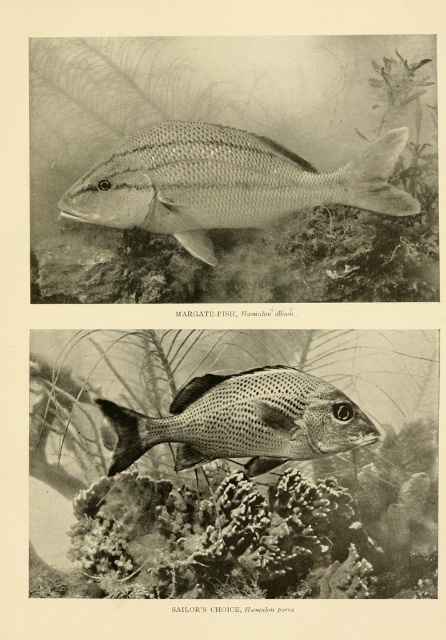
Between smooth silver fish at center and speckled silver fish at center, which one has more height?

Standing taller between the two is smooth silver fish at center.

This screenshot has height=640, width=446. I want to click on smooth silver fish at center, so click(x=224, y=182).

I want to click on smooth silver fish at center, so click(x=224, y=182).

Can you confirm if speckled coral at center is bigger than speckled silver fish at center?

Indeed, speckled coral at center has a larger size compared to speckled silver fish at center.

Is speckled coral at center below speckled silver fish at center?

Indeed, speckled coral at center is positioned under speckled silver fish at center.

At what (x,y) coordinates should I click in order to perform the action: click on speckled coral at center. Please return your answer as a coordinate pair (x, y). The image size is (446, 640). Looking at the image, I should click on (259, 531).

Locate an element on the screen. speckled coral at center is located at coordinates (259, 531).

Which is behind, point (79, 524) or point (128, 164)?

Positioned behind is point (79, 524).

Does speckled coral at center lie behind smooth silver fish at center?

No, speckled coral at center is closer to the viewer.

Who is more distant from viewer, [424,451] or [404,192]?

The point [424,451] is more distant.

This screenshot has height=640, width=446. Find the location of `speckled coral at center`. speckled coral at center is located at coordinates (259, 531).